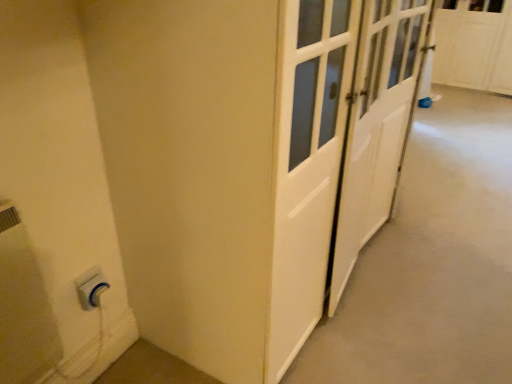
Where is `white plastic electric outlet at lower left`? white plastic electric outlet at lower left is located at coordinates (91, 288).

Image resolution: width=512 pixels, height=384 pixels. What do you see at coordinates (91, 288) in the screenshot?
I see `white plastic electric outlet at lower left` at bounding box center [91, 288].

You are a GUI agent. You are given a task and a screenshot of the screen. Output one action in this format:
    pyautogui.click(x=<x>, y=<y>)
    Task: Click on the white plastic electric outlet at lower left
    The width and height of the screenshot is (512, 384).
    Given the screenshot: What is the action you would take?
    pyautogui.click(x=91, y=288)